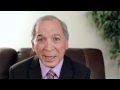
The height and width of the screenshot is (90, 120). I want to click on plant, so click(108, 27).